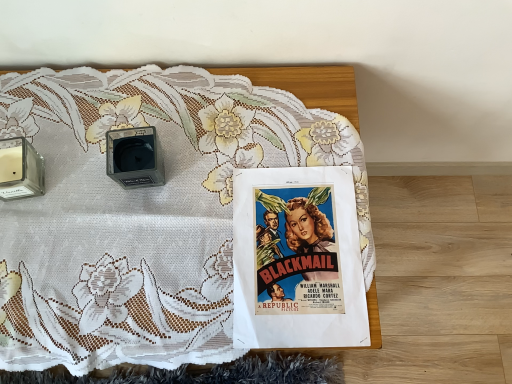
This screenshot has width=512, height=384. What are the coordinates of `free space that is to the left of matte paper poster at center` in the screenshot? It's located at (170, 255).